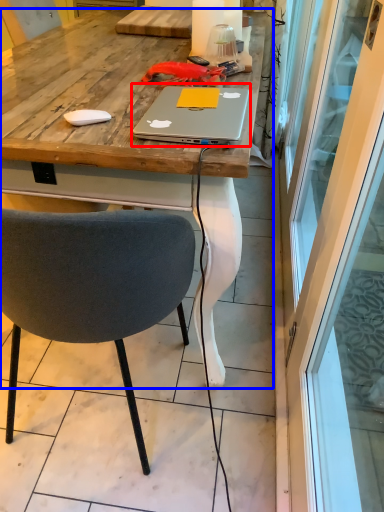
Question: Which point is further to the camera, laptop (highlighted by a red box) or desk (highlighted by a blue box)?

Choices:
 (A) laptop
 (B) desk

Answer: (B)